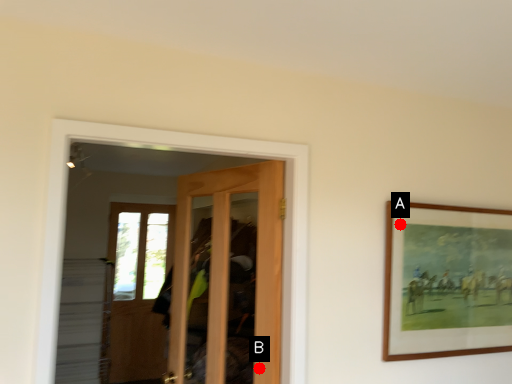
Question: Two points are circled on the image, labeled by A and B beside each circle. Which point is farther to the camera?

Choices:
 (A) A is further
 (B) B is further

Answer: (A)